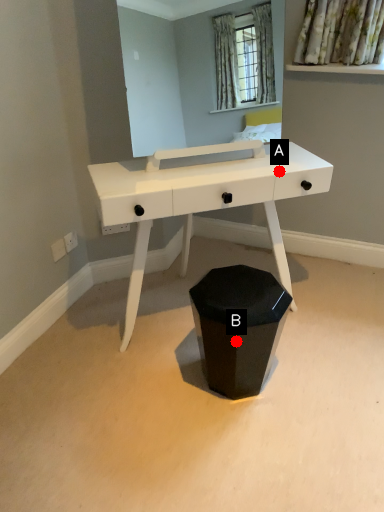
Question: Two points are circled on the image, labeled by A and B beside each circle. Which point is further to the camera?

Choices:
 (A) A is further
 (B) B is further

Answer: (B)